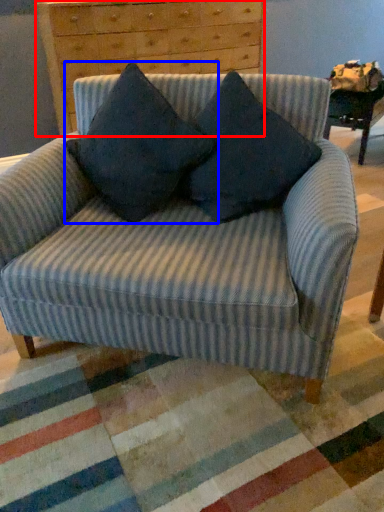
Question: Which of the following is the farthest to the observer, chest of drawers (highlighted by a red box) or pillow (highlighted by a blue box)?

Choices:
 (A) chest of drawers
 (B) pillow

Answer: (A)